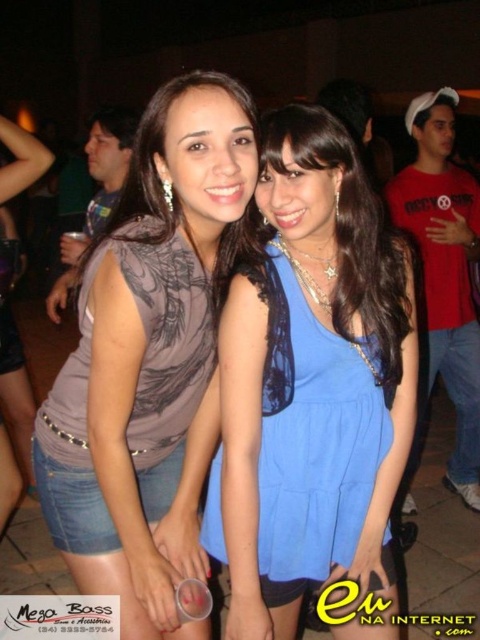
Question: Does matte gray tank top at center lie behind blue lace dress at center?

Choices:
 (A) yes
 (B) no

Answer: (B)

Question: Which point is closer to the camera?

Choices:
 (A) (275, 260)
 (B) (36, 422)

Answer: (A)

Question: Which of these objects is positioned closest to the matte gray tank top at center?

Choices:
 (A) blue lace dress at center
 (B) matte gray shirt at center

Answer: (B)

Question: Is matte gray shirt at center bigger than matte gray tank top at center?

Choices:
 (A) yes
 (B) no

Answer: (A)

Question: Is matte gray shirt at center to the right of matte gray tank top at center from the viewer's perspective?

Choices:
 (A) no
 (B) yes

Answer: (B)

Question: Which is farther from the blue lace dress at center?

Choices:
 (A) matte gray tank top at center
 (B) matte gray shirt at center

Answer: (A)